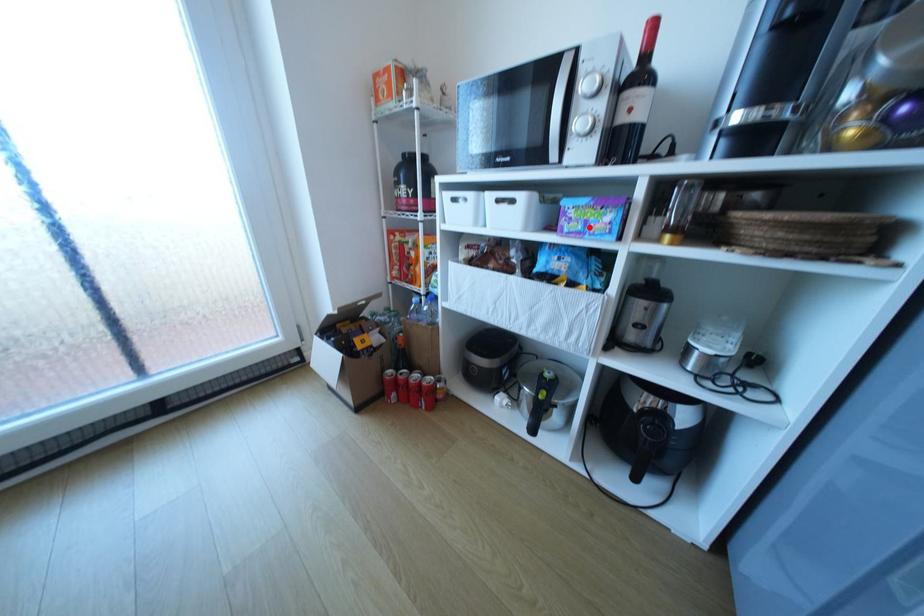
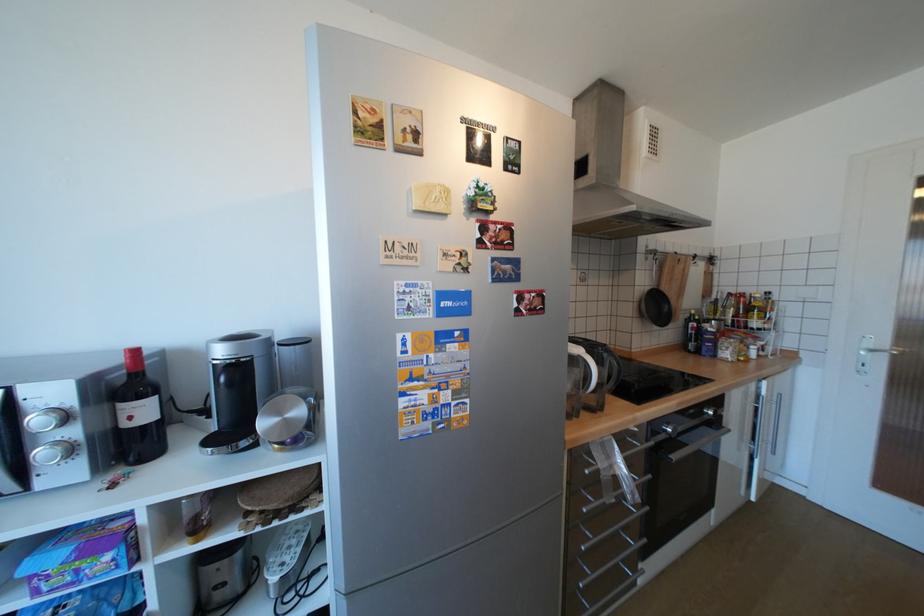
Find the pixel in the second image that matches the highlighted location in the first image.

(79, 578)